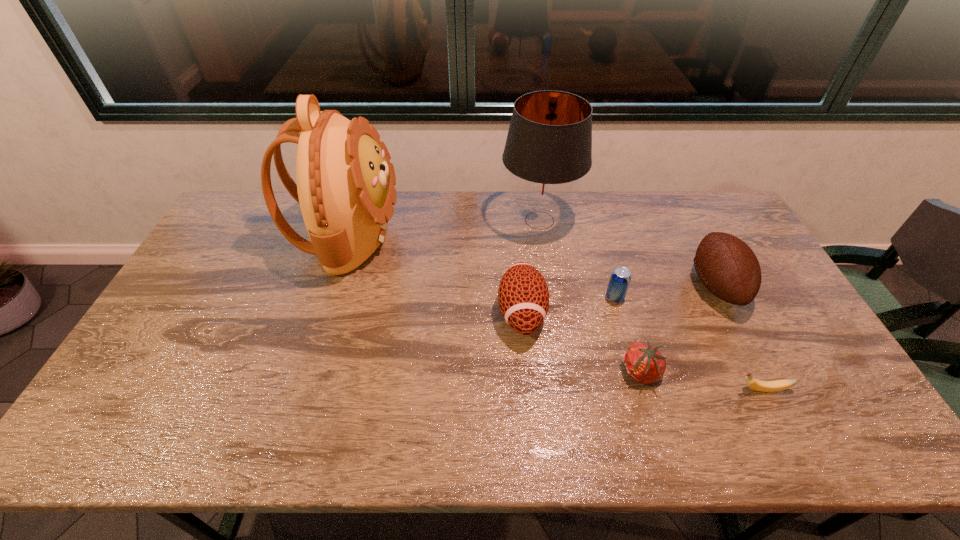
This screenshot has height=540, width=960. What are the coordinates of `free space located 0.110m on the laces of the right football` in the screenshot? It's located at (655, 286).

You are a GUI agent. You are given a task and a screenshot of the screen. Output one action in this format:
    pyautogui.click(x=<x>, y=<y>)
    Task: Click on the vacant space located 0.100m on the laces of the right football
    Image resolution: width=960 pixels, height=540 pixels.
    Given the screenshot: What is the action you would take?
    pyautogui.click(x=658, y=286)

Where is `free space located 0.290m on the left of the left football`? The height and width of the screenshot is (540, 960). free space located 0.290m on the left of the left football is located at coordinates (397, 313).

Where is `vacant space located on the back of the beer can`? vacant space located on the back of the beer can is located at coordinates (610, 278).

Identify the location of vacant space positioned 0.340m on the back of the tomato. (610, 265).

Locate an element on the screen. This screenshot has width=960, height=540. free space located 0.350m at the stem of the banana is located at coordinates (592, 389).

Locate an element on the screen. The image size is (960, 540). vacant space located 0.370m at the stem of the banana is located at coordinates (585, 389).

At what (x,y) coordinates should I click in order to perform the action: click on vacant position located 0.050m at the stem of the banana. Please return your answer as a coordinate pair (x, y). This screenshot has height=540, width=960. Looking at the image, I should click on (712, 389).

Where is `backpack located in the far edge section of the desktop`? This screenshot has width=960, height=540. backpack located in the far edge section of the desktop is located at coordinates (345, 181).

Identify the location of lampshade that is at the far edge. click(x=548, y=148).